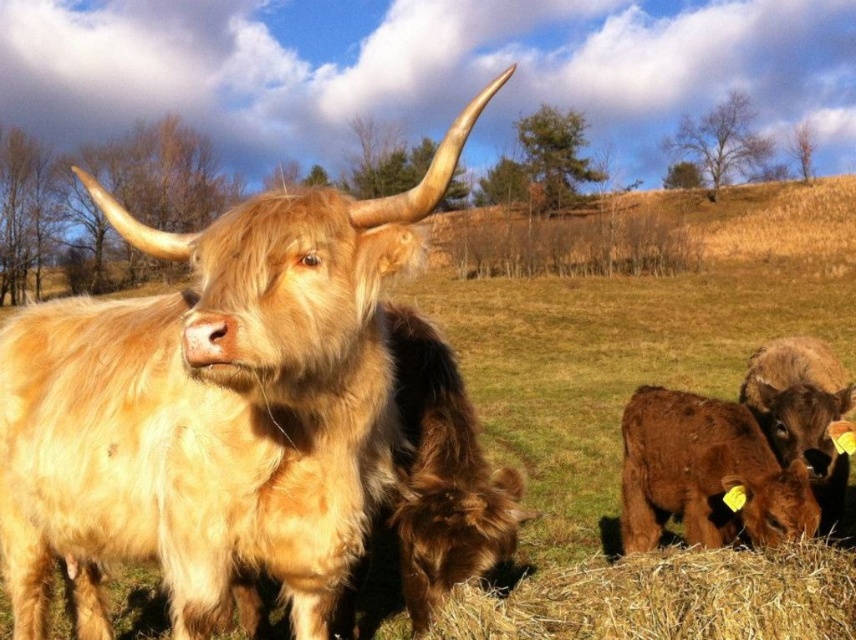
You are a farmer checking the pasture. You see the golden woolen bull at center and the brown fuzzy calf at lower right. Which animal is smaller in size?

The golden woolen bull at center is smaller in size compared to the brown fuzzy calf at lower right according to the description.

You are a farmer checking the field. You see the golden woolen bull at center and the golden straw bale at lower right. Which object is positioned higher in the image?

The golden woolen bull at center is located above the golden straw bale at lower right, so the golden woolen bull at center is higher in the image.

From the picture: You are a farmer checking the field. You need to move the golden woolen bull at center and the brown fuzzy calf at lower right to a pen that can only accommodate one animal at a time. Which animal should you move first to ensure the pen can fit both animals without overcrowding?

You should move the brown fuzzy calf at lower right first because the golden woolen bull at center is wider. By moving the smaller calf first, there will be enough space left for the wider bull afterward.